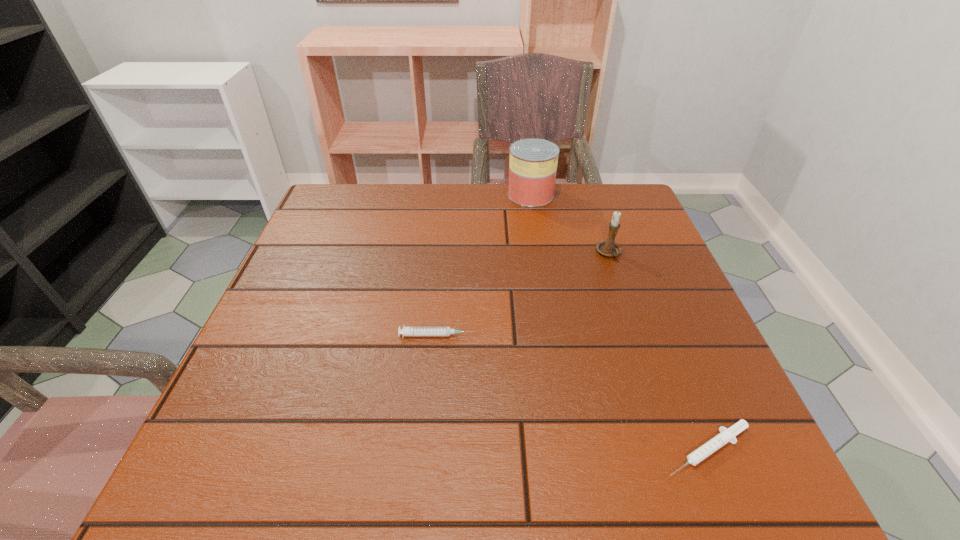
Locate an element on the screen. The image size is (960, 540). free space that is in between the can and the third shortest object is located at coordinates (570, 224).

In order to click on free space between the right syringe and the farthest object in this screenshot , I will do `click(619, 322)`.

Find the location of a particular element. This screenshot has height=540, width=960. vacant area between the third shortest object and the tallest object is located at coordinates (570, 224).

Select which object is the third closest to the right syringe. Please provide its 2D coordinates. Your answer should be formatted as a tuple, i.e. [(x, y)], where the tuple contains the x and y coordinates of a point satisfying the conditions above.

[(533, 162)]

Identify which object is the closest to the leftmost object. Please provide its 2D coordinates. Your answer should be formatted as a tuple, i.e. [(x, y)], where the tuple contains the x and y coordinates of a point satisfying the conditions above.

[(726, 435)]

Where is `vacant region that satisfies the following two spatial constraints: 1. on the front side of the can; 2. at the needle end of the farther syringe`? vacant region that satisfies the following two spatial constraints: 1. on the front side of the can; 2. at the needle end of the farther syringe is located at coordinates (553, 335).

At what (x,y) coordinates should I click in order to perform the action: click on vacant region that satisfies the following two spatial constraints: 1. at the needle end of the leftmost object; 2. on the right side of the right syringe. Please return your answer as a coordinate pair (x, y). Looking at the image, I should click on (427, 450).

Identify the location of vacant point that satisfies the following two spatial constraints: 1. on the front side of the tallest object; 2. at the needle end of the second nearest object. (553, 335).

Find the location of `vacant space that satisfies the following two spatial constraints: 1. on the front side of the can; 2. on the right side of the shorter syringe`. vacant space that satisfies the following two spatial constraints: 1. on the front side of the can; 2. on the right side of the shorter syringe is located at coordinates (571, 450).

This screenshot has width=960, height=540. In order to click on vacant position in the image that satisfies the following two spatial constraints: 1. on the side of the third nearest object with the handle; 2. at the needle end of the leftmost object in this screenshot , I will do `click(637, 335)`.